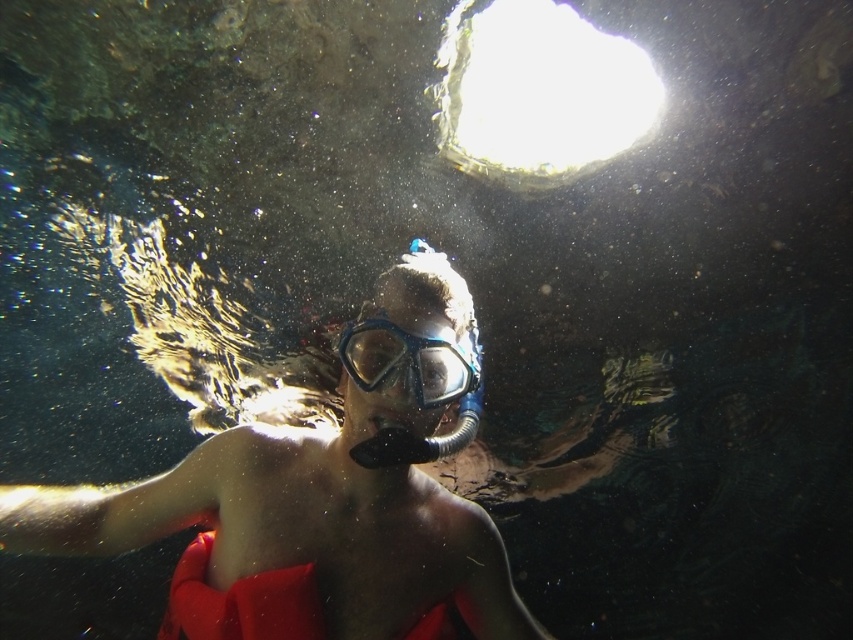
Question: Does matte skin diver at center have a greater width compared to transparent rubber goggles at center?

Choices:
 (A) yes
 (B) no

Answer: (A)

Question: Which of the following is the farthest from the observer?

Choices:
 (A) matte skin diver at center
 (B) transparent rubber goggles at center

Answer: (B)

Question: Does matte skin diver at center come in front of transparent rubber goggles at center?

Choices:
 (A) yes
 (B) no

Answer: (A)

Question: Can you confirm if matte skin diver at center is wider than transparent rubber goggles at center?

Choices:
 (A) no
 (B) yes

Answer: (B)